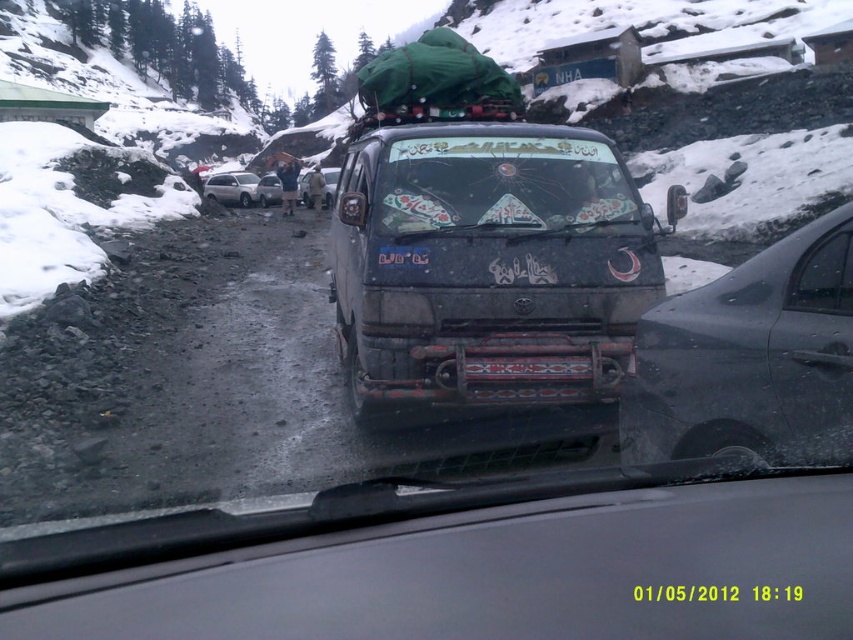
Question: Which point is farther to the camera?

Choices:
 (A) glossy metallic car at right
 (B) metallic silver car at center
 (C) redtexturedlicense plate at center
 (D) decorative glass windshield at center

Answer: (B)

Question: Estimate the real-world distances between objects in this image. Which object is farther from the redtexturedlicense plate at center?

Choices:
 (A) white matte car at center
 (B) dirty matte van at center

Answer: (A)

Question: Is white matte car at center wider than metallic silver car at center?

Choices:
 (A) yes
 (B) no

Answer: (A)

Question: Is dirty matte van at center below redtexturedlicense plate at center?

Choices:
 (A) no
 (B) yes

Answer: (A)

Question: Which object appears farthest from the camera in this image?

Choices:
 (A) redtexturedlicense plate at center
 (B) metallic silver car at center
 (C) green fabric load at center

Answer: (B)

Question: Is glossy metallic car at right to the left of redtexturedlicense plate at center from the viewer's perspective?

Choices:
 (A) yes
 (B) no

Answer: (B)